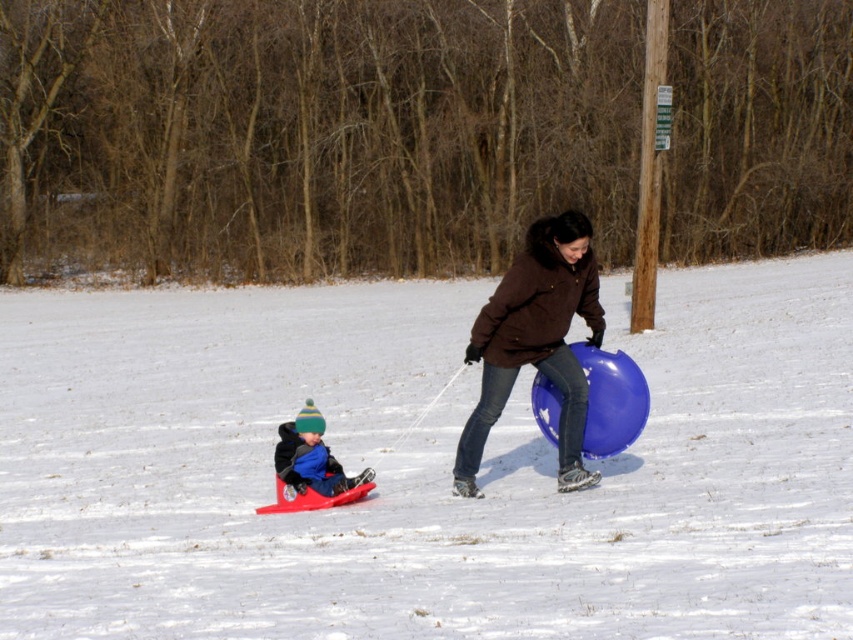
Who is positioned more to the left, white matte snow at center or brown fuzzy coat at center?

white matte snow at center

The height and width of the screenshot is (640, 853). Identify the location of white matte snow at center. (422, 467).

Which is more to the right, white matte snow at center or blue fleece jacket at lower left?

white matte snow at center is more to the right.

Is white matte snow at center taller than blue fleece jacket at lower left?

Correct, white matte snow at center is much taller as blue fleece jacket at lower left.

Who is more distant from viewer, (375,406) or (322,435)?

The point (375,406) is behind.

Find the location of `white matte snow at center`. white matte snow at center is located at coordinates (422, 467).

Between brown fuzzy coat at center and blue fleece jacket at lower left, which one appears on the right side from the viewer's perspective?

brown fuzzy coat at center

Between brown fuzzy coat at center and blue fleece jacket at lower left, which one has less height?

blue fleece jacket at lower left is shorter.

Does point (543, 234) come behind point (280, 435)?

No, it is not.

Locate an element on the screen. brown fuzzy coat at center is located at coordinates (535, 342).